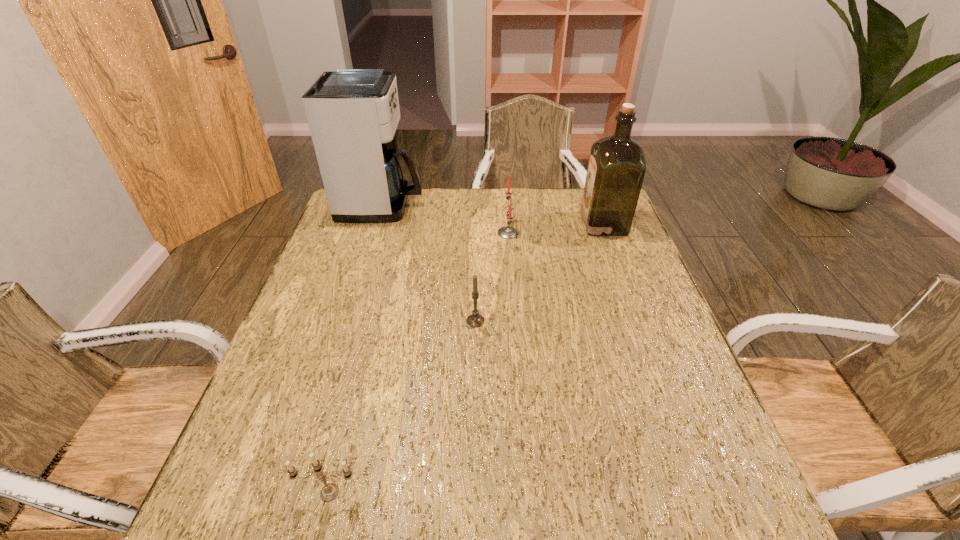
Where is `coffee maker`? coffee maker is located at coordinates (353, 114).

Locate an element on the screen. The width and height of the screenshot is (960, 540). liquor is located at coordinates (616, 169).

Where is `the fourth object from left to right`? the fourth object from left to right is located at coordinates (507, 232).

Locate an element on the screen. The height and width of the screenshot is (540, 960). the farthest candle is located at coordinates (507, 232).

This screenshot has height=540, width=960. What are the coordinates of `the third object from left to right` in the screenshot? It's located at (475, 319).

Locate an element on the screen. The height and width of the screenshot is (540, 960). the second nearest object is located at coordinates (475, 319).

Find the location of `the nearest object`. the nearest object is located at coordinates (330, 491).

What are the coordinates of `the leftmost candle` in the screenshot? It's located at pyautogui.click(x=330, y=491).

Locate an element on the screen. vacant area situated 0.070m on the front panel of the coffee maker is located at coordinates (444, 205).

Locate an element on the screen. vacant space positioned on the label of the rightmost object is located at coordinates pos(555,224).